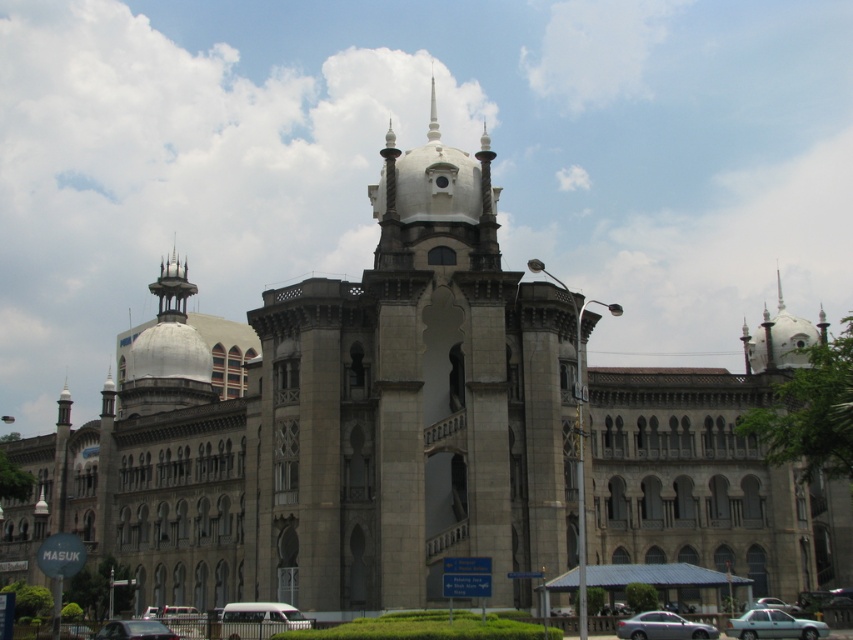
Question: Considering the real-world distances, which object is farthest from the satin silver sedan at lower center?

Choices:
 (A) metallic silver car at lower left
 (B) light blue metallic car at lower right

Answer: (A)

Question: Based on their relative distances, which object is nearer to the metallic silver car at lower right?

Choices:
 (A) satin silver sedan at lower center
 (B) metallic silver car at lower left
 (C) light blue metallic car at lower right

Answer: (C)

Question: Can you confirm if light blue metallic car at lower right is wider than satin silver sedan at lower center?

Choices:
 (A) no
 (B) yes

Answer: (B)

Question: Is the position of light blue metallic car at lower right less distant than that of metallic silver car at lower left?

Choices:
 (A) yes
 (B) no

Answer: (B)

Question: Can you confirm if metallic silver car at lower left is wider than metallic silver car at lower right?

Choices:
 (A) no
 (B) yes

Answer: (B)

Question: Which is farther from the metallic silver car at lower right?

Choices:
 (A) metallic silver car at lower left
 (B) light blue metallic car at lower right
 (C) satin silver sedan at lower center

Answer: (A)